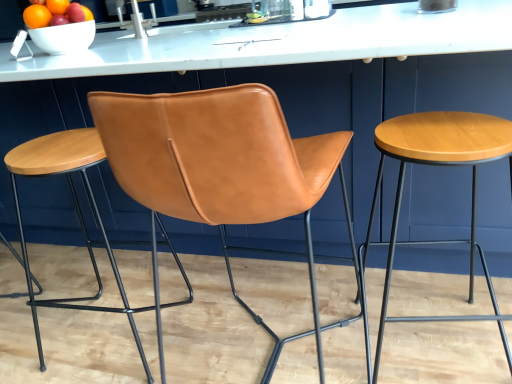
Question: From a real-world perspective, is shiny ceramic bowl at upper left located beneath cognac leather chair at center?

Choices:
 (A) yes
 (B) no

Answer: (B)

Question: Is shiny ceramic bowl at upper left at the left side of cognac leather chair at center?

Choices:
 (A) yes
 (B) no

Answer: (A)

Question: Is shiny ceramic bowl at upper left at the right side of cognac leather chair at center?

Choices:
 (A) yes
 (B) no

Answer: (B)

Question: Are shiny ceramic bowl at upper left and cognac leather chair at center located far from each other?

Choices:
 (A) yes
 (B) no

Answer: (A)

Question: Is shiny ceramic bowl at upper left shorter than cognac leather chair at center?

Choices:
 (A) yes
 (B) no

Answer: (A)

Question: Could cognac leather chair at center be considered to be inside shiny ceramic bowl at upper left?

Choices:
 (A) yes
 (B) no

Answer: (B)

Question: Is white glossy bowl at upper left to the right of shiny ceramic bowl at upper left from the viewer's perspective?

Choices:
 (A) yes
 (B) no

Answer: (A)

Question: Does white glossy bowl at upper left lie in front of shiny ceramic bowl at upper left?

Choices:
 (A) yes
 (B) no

Answer: (B)

Question: Is white glossy bowl at upper left facing towards shiny ceramic bowl at upper left?

Choices:
 (A) yes
 (B) no

Answer: (B)

Question: From the image's perspective, is white glossy bowl at upper left above shiny ceramic bowl at upper left?

Choices:
 (A) yes
 (B) no

Answer: (B)

Question: Considering the relative sizes of white glossy bowl at upper left and shiny ceramic bowl at upper left in the image provided, is white glossy bowl at upper left wider than shiny ceramic bowl at upper left?

Choices:
 (A) yes
 (B) no

Answer: (B)

Question: Is the position of white glossy bowl at upper left more distant than that of shiny ceramic bowl at upper left?

Choices:
 (A) yes
 (B) no

Answer: (A)

Question: Can we say wooden stool at right, arranged as the 2th stool when viewed from the left, lies outside cognac leather chair at center?

Choices:
 (A) yes
 (B) no

Answer: (A)